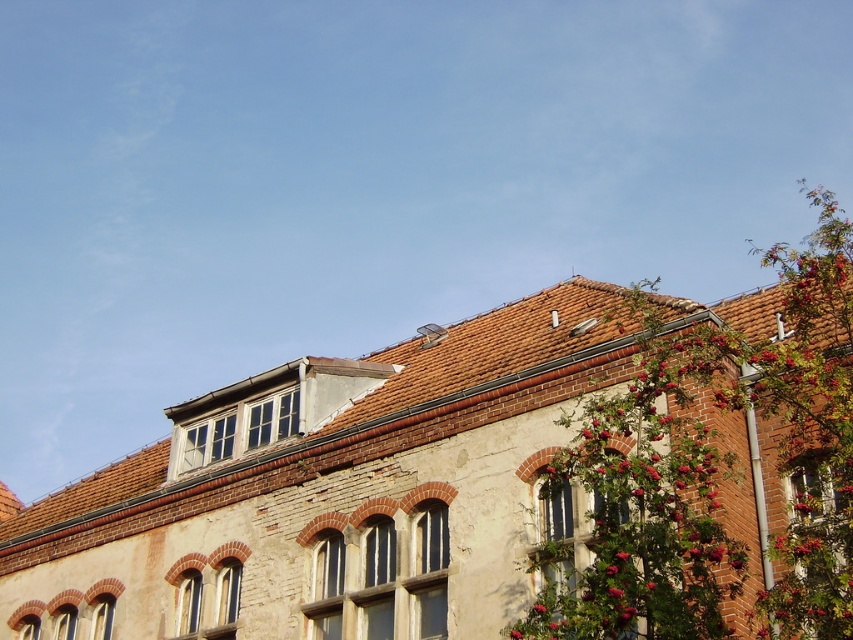
You are standing in front of the building and notice a point marked at coordinates (593, 548). Based on the scene description, what object is located at this point?

The point at coordinates (593, 548) corresponds to the matte glass window at center.

You are an architect evaluating the building facade. You notice two central windows, the brown stone window at center and the white stone window at center. Which one has a smaller size?

The brown stone window at center is smaller than the white stone window at center.